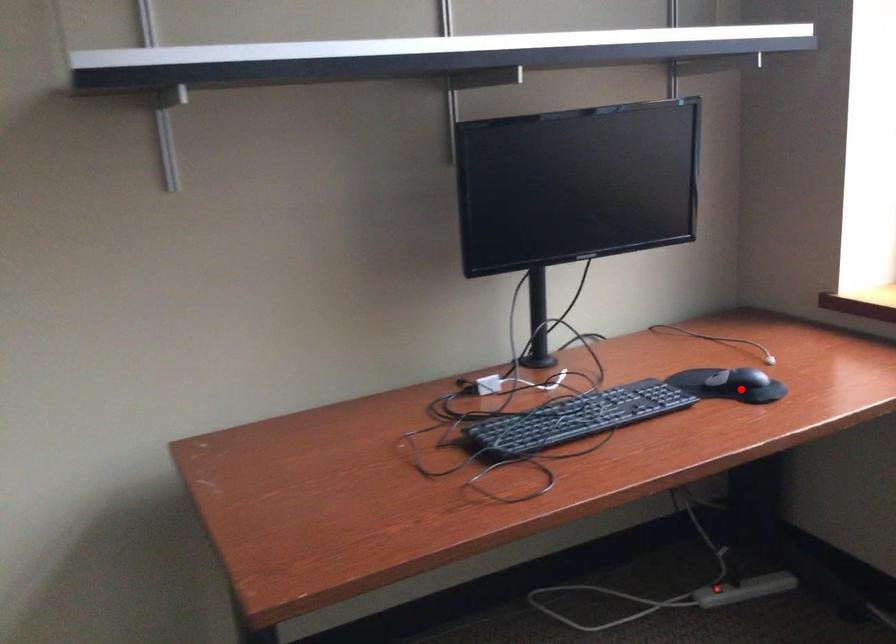
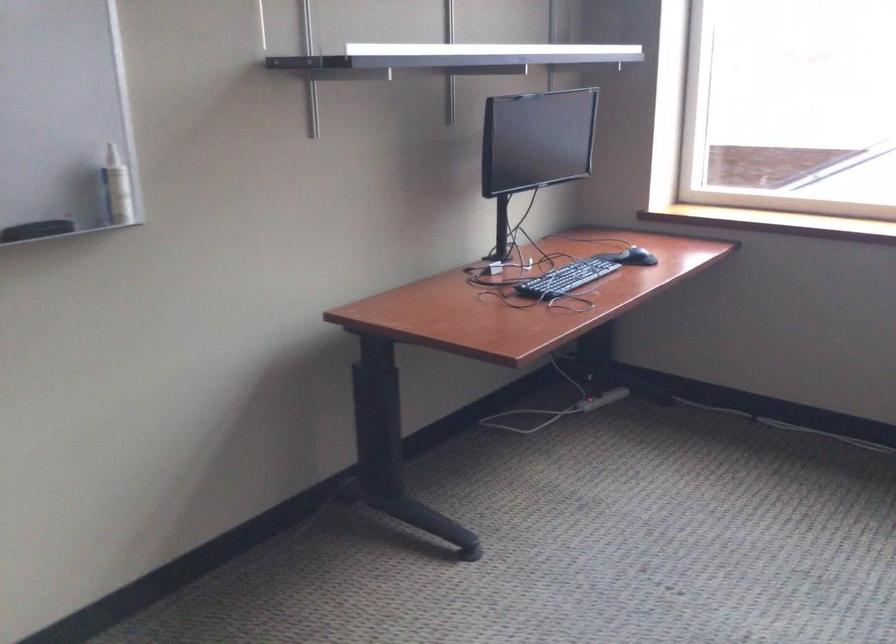
The point at the highlighted location is marked in the first image. Where is the corresponding point in the second image?

(636, 257)